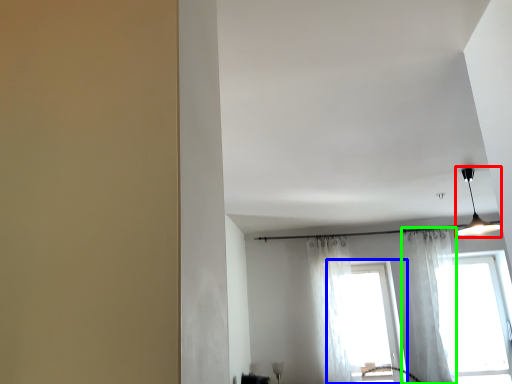
Question: Which object is positioned closest to light fixture (highlighted by a red box)? Select from window (highlighted by a blue box) and curtain (highlighted by a green box).

Choices:
 (A) window
 (B) curtain

Answer: (B)